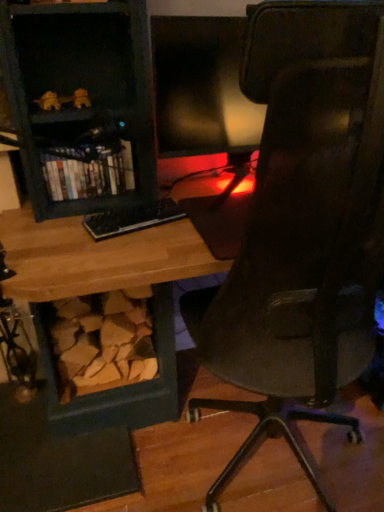
This screenshot has height=512, width=384. I want to click on free space above black plastic keyboard at center (from a real-world perspective), so click(130, 214).